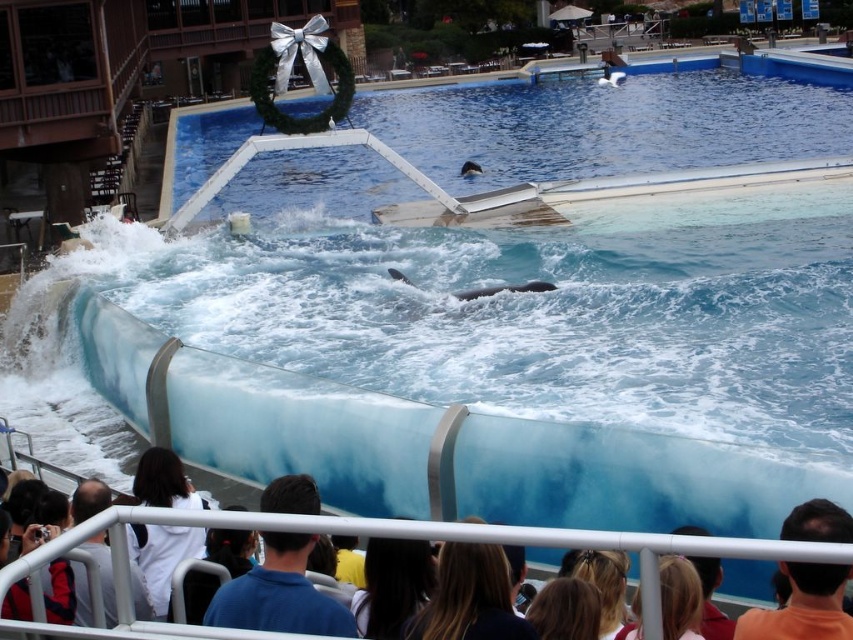
Is the position of black smooth whale at center less distant than that of gray matte whale at center?

Yes, it is.

Can you confirm if black smooth whale at center is wider than gray matte whale at center?

Indeed, black smooth whale at center has a greater width compared to gray matte whale at center.

The height and width of the screenshot is (640, 853). I want to click on black smooth whale at center, so click(x=505, y=289).

Between dark blue shirt at lower center and black smooth whale at center, which one appears on the right side from the viewer's perspective?

Positioned to the right is black smooth whale at center.

This screenshot has width=853, height=640. Describe the element at coordinates (434, 538) in the screenshot. I see `dark blue shirt at lower center` at that location.

At what (x,y) coordinates should I click in order to perform the action: click on dark blue shirt at lower center. Please return your answer as a coordinate pair (x, y). The height and width of the screenshot is (640, 853). Looking at the image, I should click on (434, 538).

Is point (172, 212) closer to viewer compared to point (546, 282)?

No.

Which is below, blue glossy water at upper center or black smooth whale at center?

black smooth whale at center is lower down.

Which is behind, point (848, 60) or point (490, 288)?

Point (848, 60)

This screenshot has height=640, width=853. I want to click on blue glossy water at upper center, so click(496, 189).